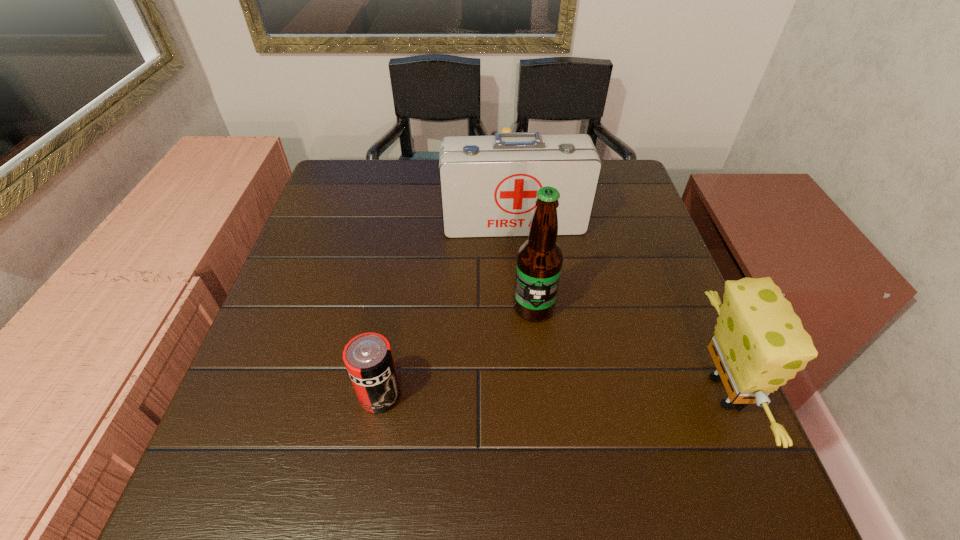
At what (x,y) coordinates should I click in order to perform the action: click on free space that satisfies the following two spatial constraints: 1. on the front side of the rightmost object; 2. on the face of the Lego. Please return your answer as a coordinate pair (x, y). The image size is (960, 540). Looking at the image, I should click on (521, 392).

Where is `blank area in the image that satisfies the following two spatial constraints: 1. on the front side of the rightmost object; 2. on the face of the Lego`? blank area in the image that satisfies the following two spatial constraints: 1. on the front side of the rightmost object; 2. on the face of the Lego is located at coordinates (521, 392).